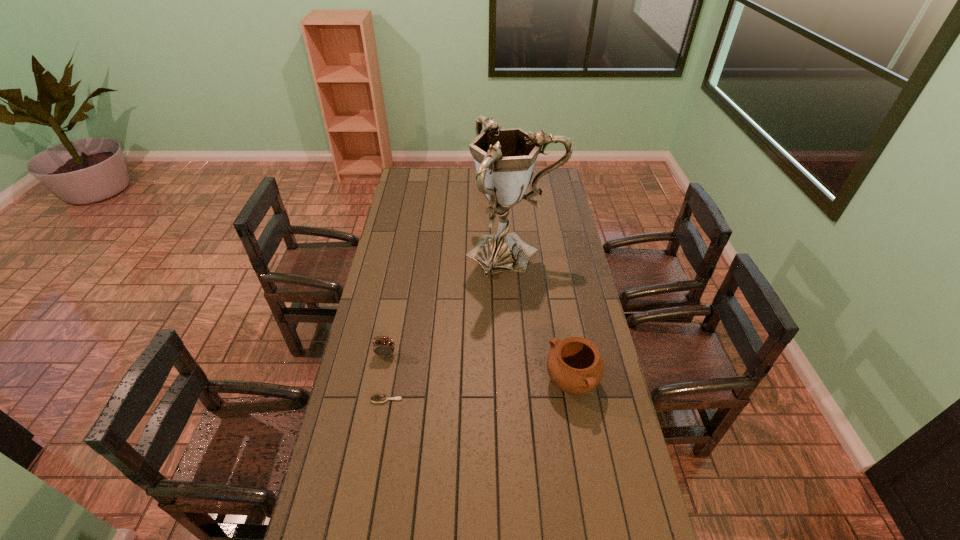
The height and width of the screenshot is (540, 960). I want to click on free spot located on the left of the pottery, so click(x=498, y=383).

This screenshot has height=540, width=960. I want to click on vacant space situated 0.090m on the face of the second shortest object, so click(x=381, y=380).

I want to click on vacant space located 0.110m on the back of the shortest object, so click(x=392, y=369).

In order to click on object that is at the far edge in this screenshot , I will do `click(500, 127)`.

At what (x,y) coordinates should I click in order to perform the action: click on alarm clock located in the left edge section of the desktop. Please return your answer as a coordinate pair (x, y). Image resolution: width=960 pixels, height=540 pixels. Looking at the image, I should click on (384, 347).

I want to click on scrubbing brush present at the left edge, so click(x=378, y=398).

This screenshot has height=540, width=960. I want to click on trophy cup that is positioned at the right edge, so click(504, 158).

Identify the location of pottery at the right edge. (574, 365).

Find the location of a particular element. This screenshot has width=960, height=540. vacant region at the left edge is located at coordinates (380, 378).

The image size is (960, 540). What are the coordinates of `vacant space at the right edge` in the screenshot? It's located at (552, 256).